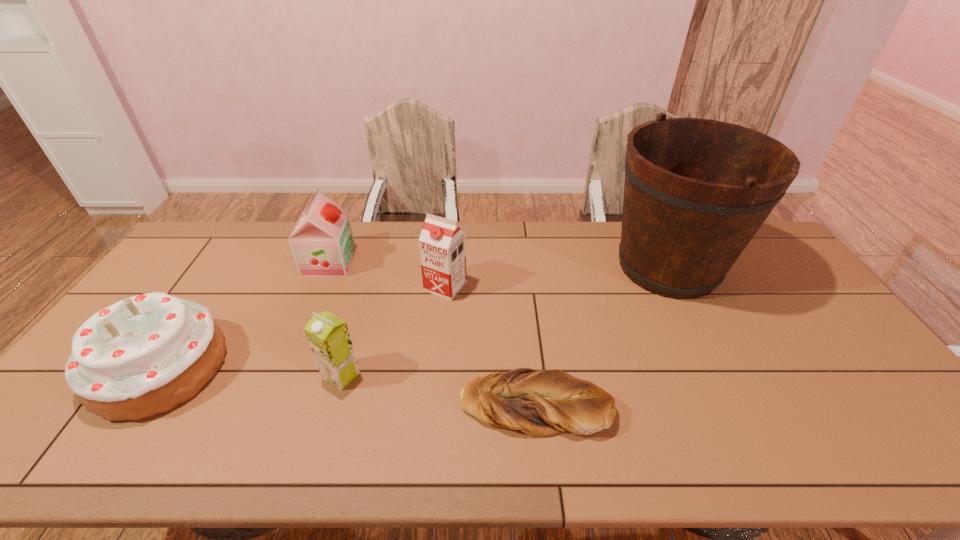
In the image, there is a desktop. Identify the location of vacant space at the left edge. (191, 282).

Locate an element on the screen. The height and width of the screenshot is (540, 960). vacant area at the right edge is located at coordinates (860, 354).

Find the location of `free space at the near right corner of the desktop`. free space at the near right corner of the desktop is located at coordinates (911, 450).

Where is `free space between the fourth object from right to left and the shortest object`? free space between the fourth object from right to left and the shortest object is located at coordinates (438, 390).

Where is `free space between the tallest object and the rightmost soya milk`? This screenshot has height=540, width=960. free space between the tallest object and the rightmost soya milk is located at coordinates (557, 276).

Locate an element on the screen. The height and width of the screenshot is (540, 960). free spot between the shortest object and the third object from left to right is located at coordinates (438, 390).

Where is `free area in between the fourth object from right to left and the leftmost object`? free area in between the fourth object from right to left and the leftmost object is located at coordinates [251, 372].

Locate an element on the screen. The image size is (960, 540). free space between the rightmost object and the leftmost soya milk is located at coordinates (498, 265).

What are the coordinates of `vacant space in between the leftmost object and the leftmost soya milk` in the screenshot? It's located at [245, 315].

Locate an element on the screen. This screenshot has height=540, width=960. vacant area that lies between the fifth object from right to left and the rightmost soya milk is located at coordinates (388, 274).